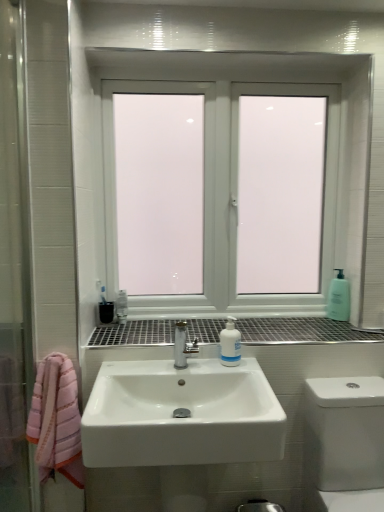
Question: From a real-world perspective, is metallic grid at center above or below white glossy toilet at lower right?

Choices:
 (A) below
 (B) above

Answer: (B)

Question: Is point coord(109,326) closer or farther from the camera than point coord(342,398)?

Choices:
 (A) closer
 (B) farther

Answer: (B)

Question: Estimate the real-world distances between objects in this image. Which object is closer to the translucent plastic soap dispenser at right?

Choices:
 (A) white plastic bottle at center
 (B) metallic grid at center
 (C) white frosted glass window at center
 (D) white glossy toilet at lower right
 (E) white glossy sink at center

Answer: (B)

Question: Which of these objects is positioned closest to the translucent plastic soap dispenser at right?

Choices:
 (A) white plastic bottle at center
 (B) white glossy sink at center
 (C) white glossy toilet at lower right
 (D) white frosted glass window at center
 (E) metallic grid at center

Answer: (E)